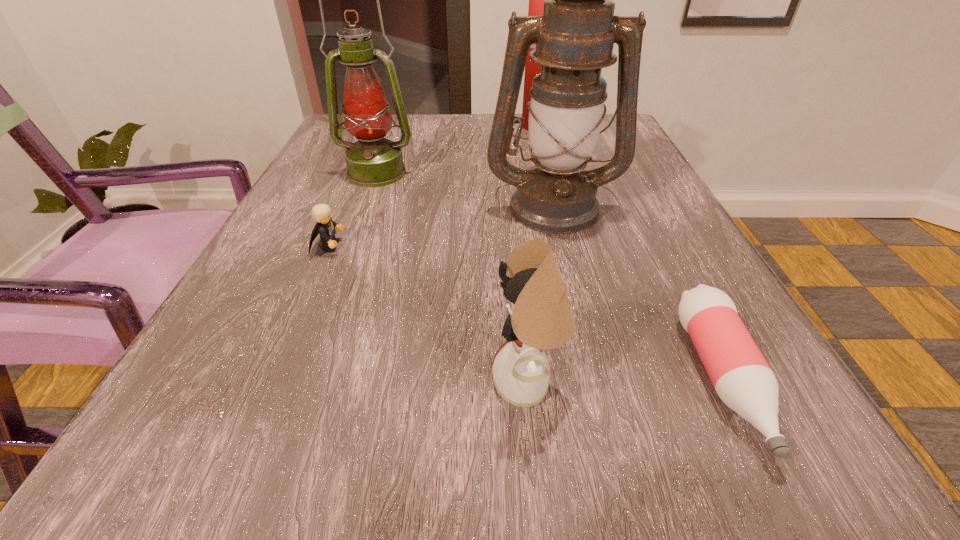
Where is `fire extinguisher`? The image size is (960, 540). fire extinguisher is located at coordinates (536, 0).

This screenshot has width=960, height=540. Find the location of `the right oil lamp`. the right oil lamp is located at coordinates (575, 36).

I want to click on the left oil lamp, so click(x=373, y=161).

You are a GUI agent. You are given a task and a screenshot of the screen. Output one action in this format:
    pyautogui.click(x=<x>, y=<y>)
    Task: Click on the doll
    The height and width of the screenshot is (540, 960).
    Given the screenshot: What is the action you would take?
    pyautogui.click(x=542, y=319)

Image resolution: width=960 pixels, height=540 pixels. I want to click on the second shortest object, so click(325, 227).

I want to click on the shortest object, so click(x=741, y=376).

At what (x,y) coordinates should I click in order to perform the action: click on vacant space located 0.170m with the nozzle and gauge on the fire extinguisher. Please return your answer as a coordinate pair (x, y). This screenshot has height=540, width=960. Looking at the image, I should click on (455, 127).

This screenshot has width=960, height=540. In order to click on vacant space situated with the nozzle and gauge on the fire extinguisher in this screenshot , I will do `click(385, 127)`.

I want to click on free location located 0.120m with the nozzle and gauge on the fire extinguisher, so click(474, 127).

This screenshot has height=540, width=960. I want to click on vacant region located on the front of the right oil lamp, so click(x=568, y=271).